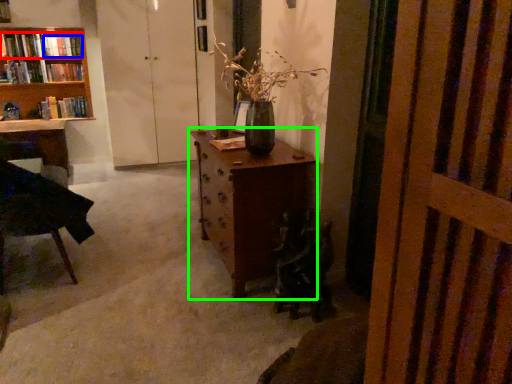
Question: Estimate the real-world distances between objects in this image. Which object is farther from book (highlighted by a red box), book (highlighted by a blue box) or table (highlighted by a green box)?

Choices:
 (A) book
 (B) table

Answer: (B)